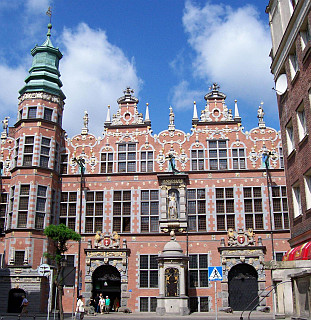
What are the coordinates of `statue` in the screenshot? It's located at click(x=173, y=203).